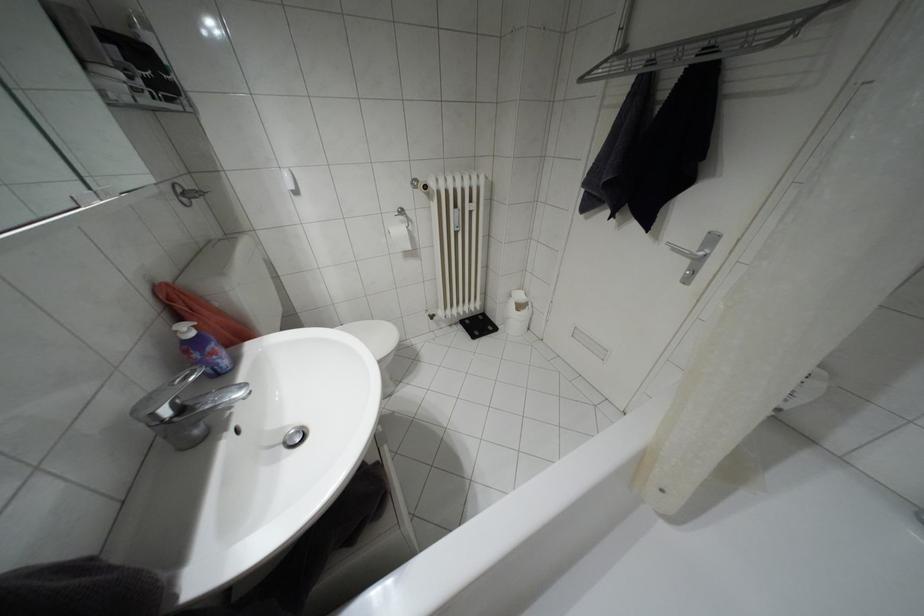
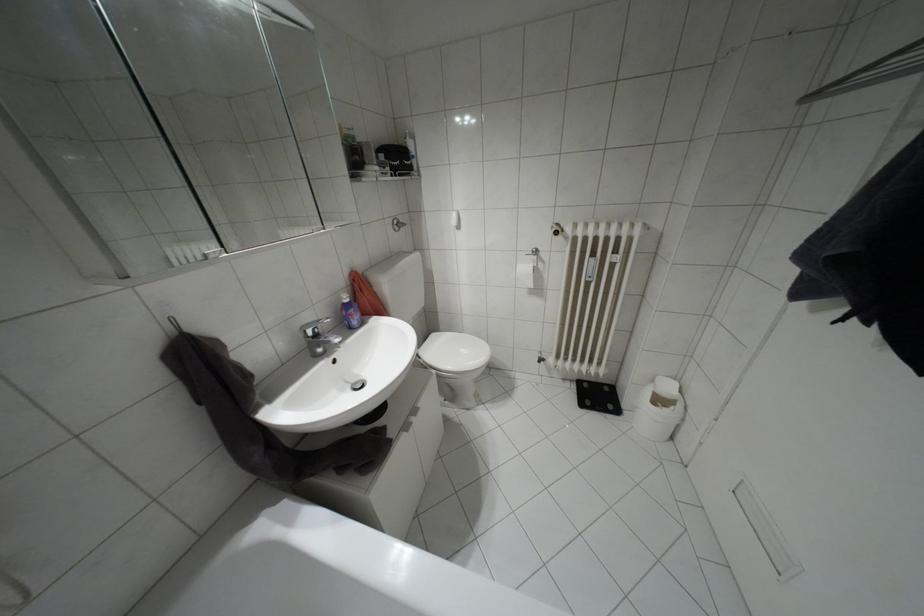
Question: Based on the continuous images, in which direction is the camera rotating? Reply with the corresponding letter.

Choices:
 (A) Left
 (B) Right
 (C) Up
 (D) Down

Answer: (A)